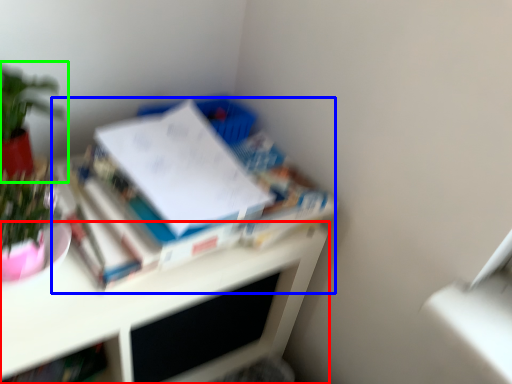
Question: Which object is the closest to the desk (highlighted by a red box)? Choose among these: book (highlighted by a blue box) or houseplant (highlighted by a green box).

Choices:
 (A) book
 (B) houseplant

Answer: (A)